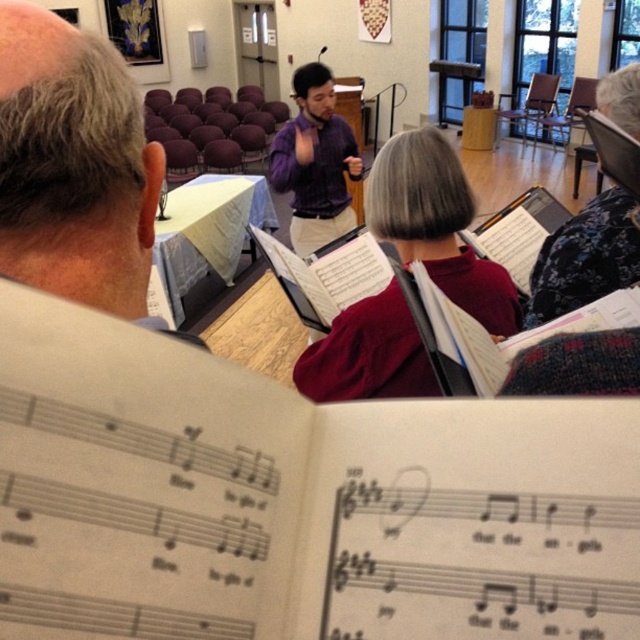
Question: Considering the real-world distances, which object is closest to the maroon sweater at center?

Choices:
 (A) purple matte shirt at center
 (B) gray hair at upper left

Answer: (B)

Question: Which point is farther to the camera?

Choices:
 (A) gray hair at upper left
 (B) purple matte shirt at center

Answer: (B)

Question: Does gray hair at upper left appear on the left side of maroon sweater at center?

Choices:
 (A) yes
 (B) no

Answer: (A)

Question: Can you confirm if gray hair at upper left is positioned to the right of maroon sweater at center?

Choices:
 (A) no
 (B) yes

Answer: (A)

Question: Is gray hair at upper left thinner than maroon sweater at center?

Choices:
 (A) yes
 (B) no

Answer: (A)

Question: Among these objects, which one is nearest to the camera?

Choices:
 (A) maroon sweater at center
 (B) purple matte shirt at center
 (C) gray hair at upper left

Answer: (C)